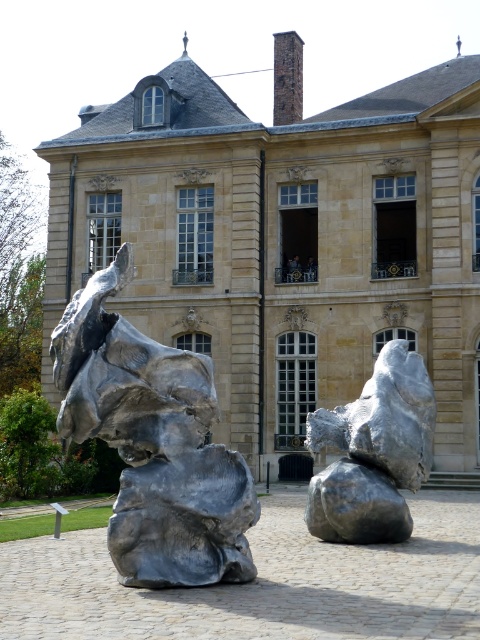
Question: Which point is farther to the camera?

Choices:
 (A) (314, 428)
 (B) (308, 502)

Answer: (A)

Question: Which point is closer to the camera?

Choices:
 (A) shiny metallic rock at center
 (B) matte stone sculpture at center
 (C) brushed metal sculpture at center
 (D) brushed metal rock at center

Answer: (C)

Question: Is brushed metal sculpture at center below shiny metallic rock at center?

Choices:
 (A) yes
 (B) no

Answer: (B)

Question: Does brushed metal rock at center lie in front of shiny metallic rock at center?

Choices:
 (A) no
 (B) yes

Answer: (A)

Question: Does matte stone sculpture at center have a lesser width compared to brushed metal rock at center?

Choices:
 (A) no
 (B) yes

Answer: (A)

Question: Which point appears farthest from the camera in this image?

Choices:
 (A) (243, 321)
 (B) (396, 529)
 (C) (103, 403)

Answer: (A)